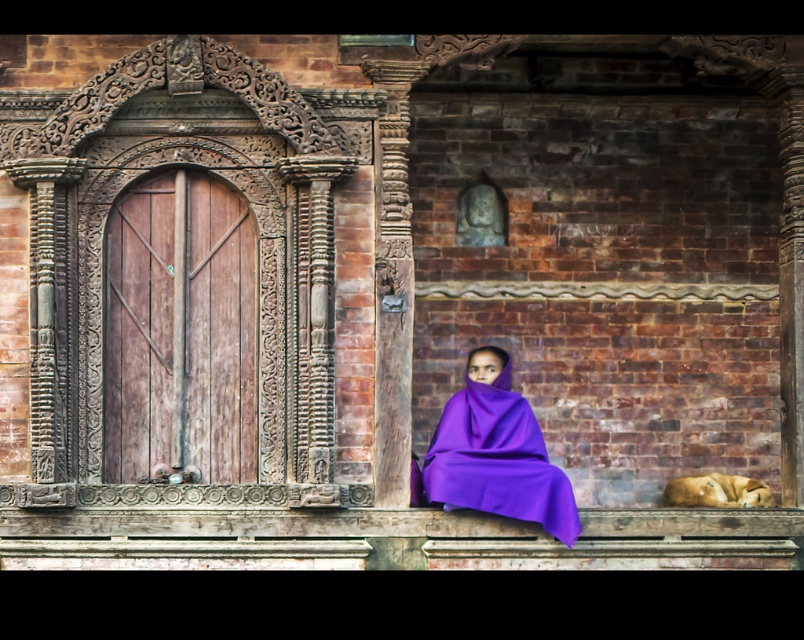
Does purple fabric at center appear over golden fur dog at lower right?

Yes.

Based on the photo, is purple fabric at center thinner than golden fur dog at lower right?

No, purple fabric at center is not thinner than golden fur dog at lower right.

Describe the element at coordinates (495, 452) in the screenshot. I see `purple fabric at center` at that location.

This screenshot has height=640, width=804. Find the location of `purple fabric at center`. purple fabric at center is located at coordinates (495, 452).